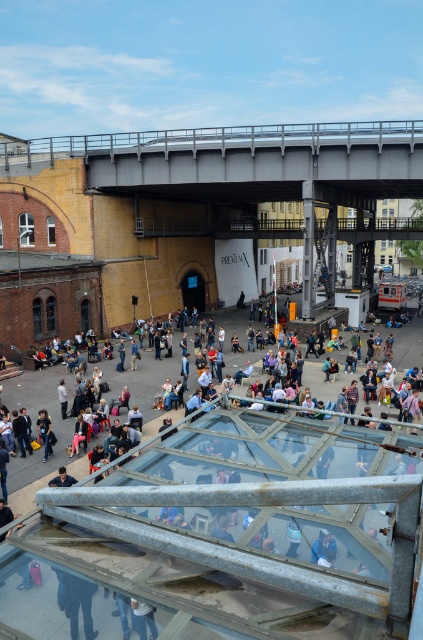
Question: Which point is farther to the camera?

Choices:
 (A) (154, 248)
 (B) (57, 627)

Answer: (A)

Question: Does matte black jacket at center appear under gray metallic bridge at upper center?

Choices:
 (A) no
 (B) yes

Answer: (B)

Question: Is matte black jacket at center below gray metallic bridge at upper center?

Choices:
 (A) yes
 (B) no

Answer: (A)

Question: Can you confirm if matte black jacket at center is positioned to the right of gray metallic bridge at upper center?

Choices:
 (A) no
 (B) yes

Answer: (A)

Question: Which object is farther from the camera taking this photo?

Choices:
 (A) gray metallic bridge at upper center
 (B) matte black jacket at center

Answer: (A)